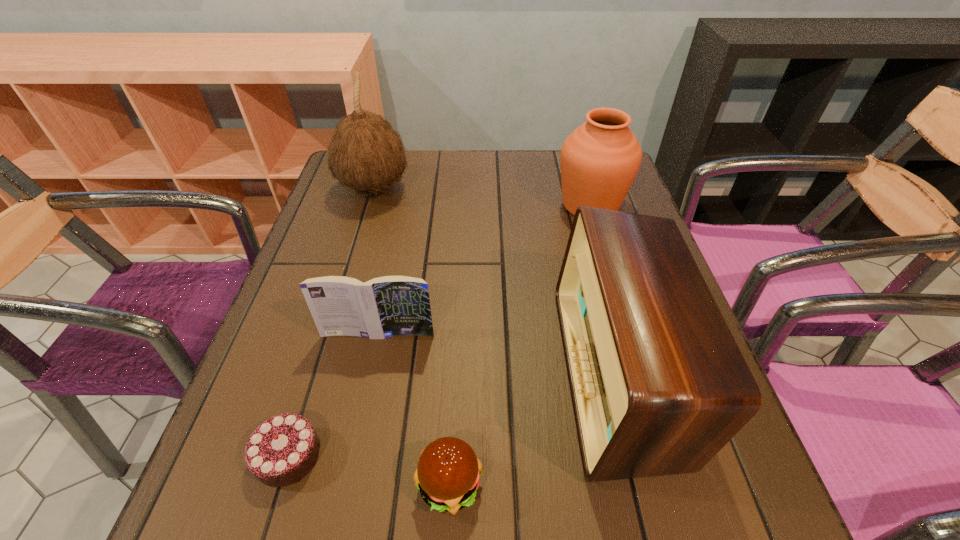
I want to click on vacant space located 0.150m on the front-facing side of the radio receiver, so click(x=483, y=373).

Locate an element on the screen. This screenshot has height=540, width=960. vacant region located 0.080m on the front cover of the book is located at coordinates tap(370, 376).

The height and width of the screenshot is (540, 960). Find the location of `vacant space located on the back of the second shortest object`. vacant space located on the back of the second shortest object is located at coordinates (453, 416).

Locate an element on the screen. The height and width of the screenshot is (540, 960). vacant area located 0.330m on the right of the chocolate cake is located at coordinates (534, 455).

Image resolution: width=960 pixels, height=540 pixels. I want to click on coconut located at the far edge, so click(x=366, y=154).

Find the location of a particular element. This screenshot has height=540, width=960. urn located at the far edge is located at coordinates (600, 159).

Where is `radio receiver that is at the near edge`? radio receiver that is at the near edge is located at coordinates (659, 386).

The image size is (960, 540). Identify the location of hamburger at the near edge. (448, 474).

Locate an element on the screen. Image resolution: width=960 pixels, height=540 pixels. chocolate cake that is at the near edge is located at coordinates (281, 451).

Where is `coconut that is at the left edge`? coconut that is at the left edge is located at coordinates (366, 154).